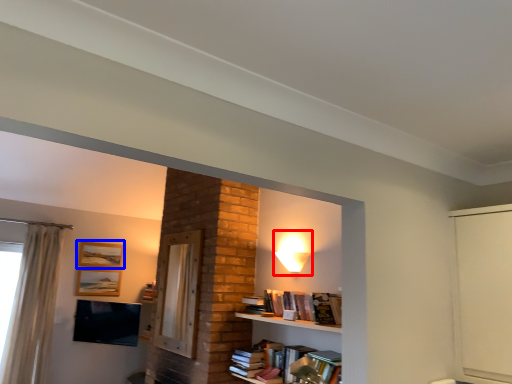
Question: Which point is further to the camera, lamp (highlighted by a red box) or picture frame (highlighted by a blue box)?

Choices:
 (A) lamp
 (B) picture frame

Answer: (B)